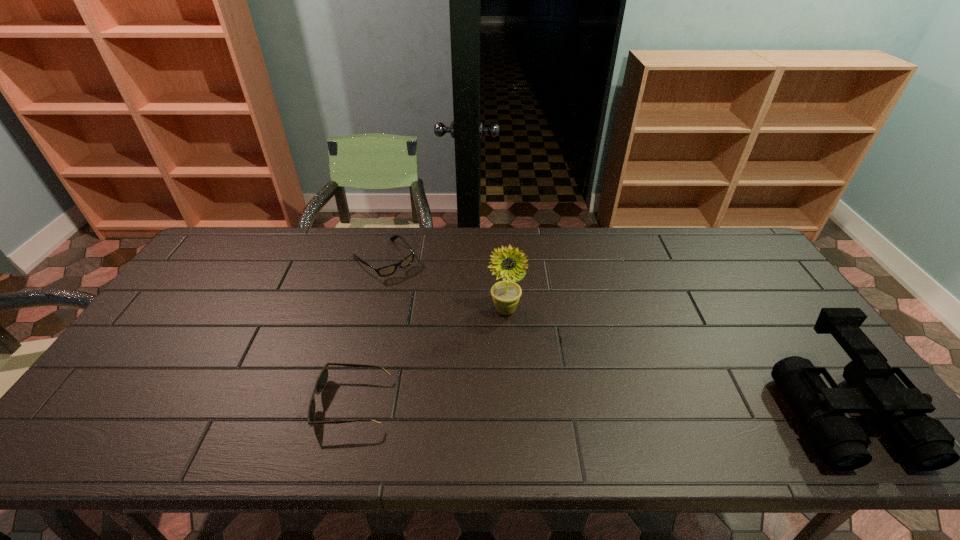
The height and width of the screenshot is (540, 960). Find the location of `sunglasses`. sunglasses is located at coordinates (322, 379).

I want to click on the third shortest object, so click(875, 389).

In order to click on binoculars in this screenshot , I will do `click(875, 389)`.

Identify the location of the farthest object. This screenshot has width=960, height=540. pos(388,270).

You are a GUI agent. You are given a task and a screenshot of the screen. Output one action in this format:
    pyautogui.click(x=<x>, y=<y>)
    Task: Click on the third nearest object
    This screenshot has width=960, height=540.
    Given the screenshot: What is the action you would take?
    tap(506, 294)

Identify the location of the second object from right to left. The height and width of the screenshot is (540, 960). (506, 294).

Locate an element on the screen. This screenshot has height=540, width=960. blank space located 0.210m on the lenses of the sunglasses is located at coordinates click(229, 402).

I want to click on free point located 0.190m on the lenses of the sunglasses, so click(x=237, y=402).

Locate an element on the screen. vacant space positioned on the lenses of the sunglasses is located at coordinates (237, 402).

The width and height of the screenshot is (960, 540). Find the location of `vacant area located on the front-facing side of the spectacles`. vacant area located on the front-facing side of the spectacles is located at coordinates (466, 338).